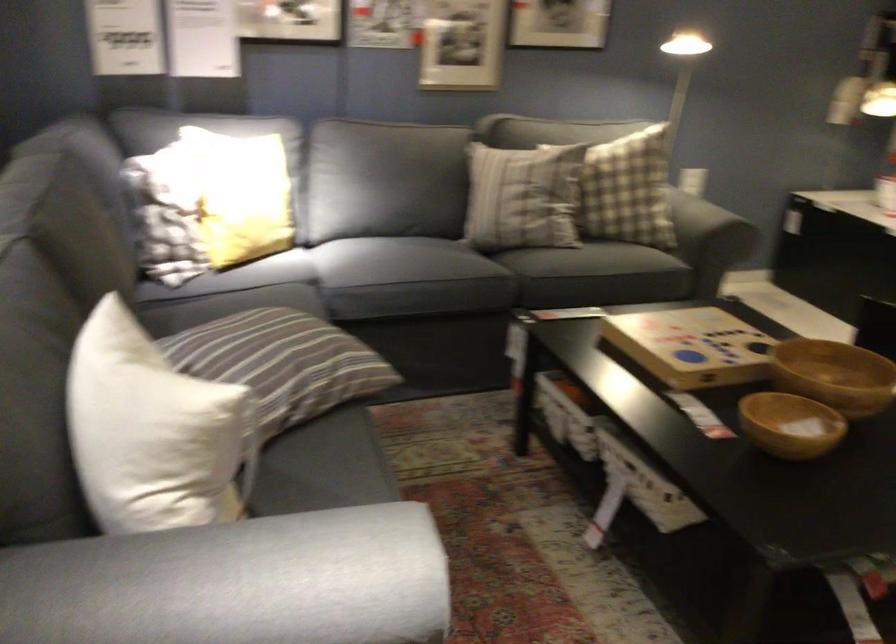
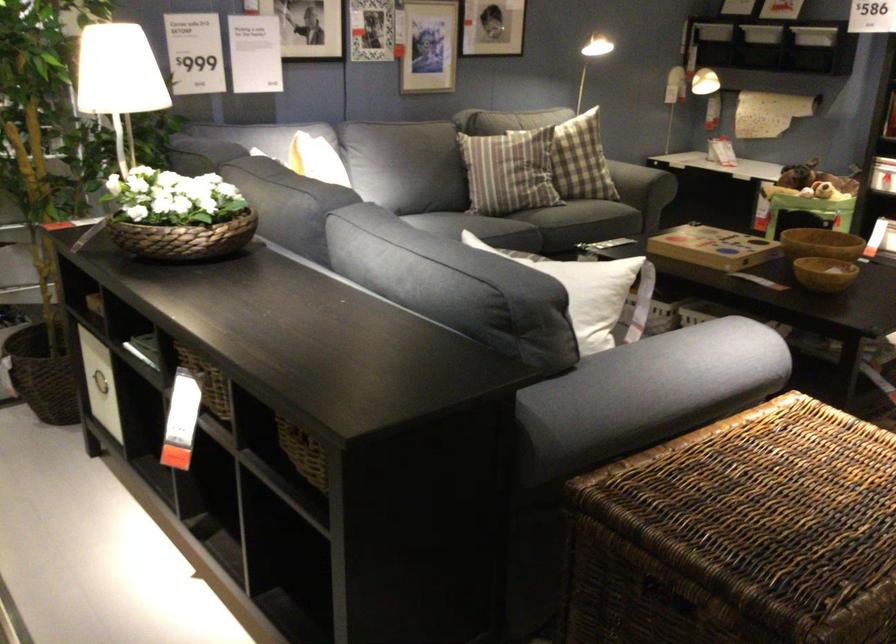
Find the pixel in the second image that matches [170,391] in the first image.

(581, 272)